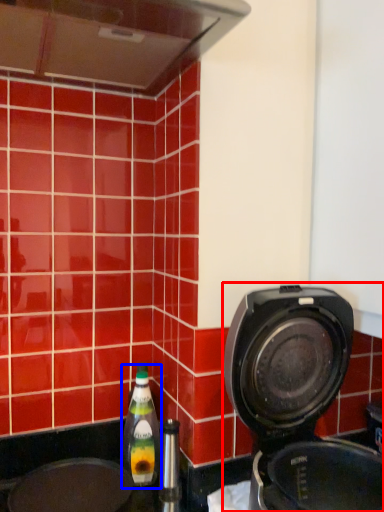
Question: Which object appears closest to the camera in this image, home appliance (highlighted by a red box) or bottle (highlighted by a blue box)?

Choices:
 (A) home appliance
 (B) bottle

Answer: (A)